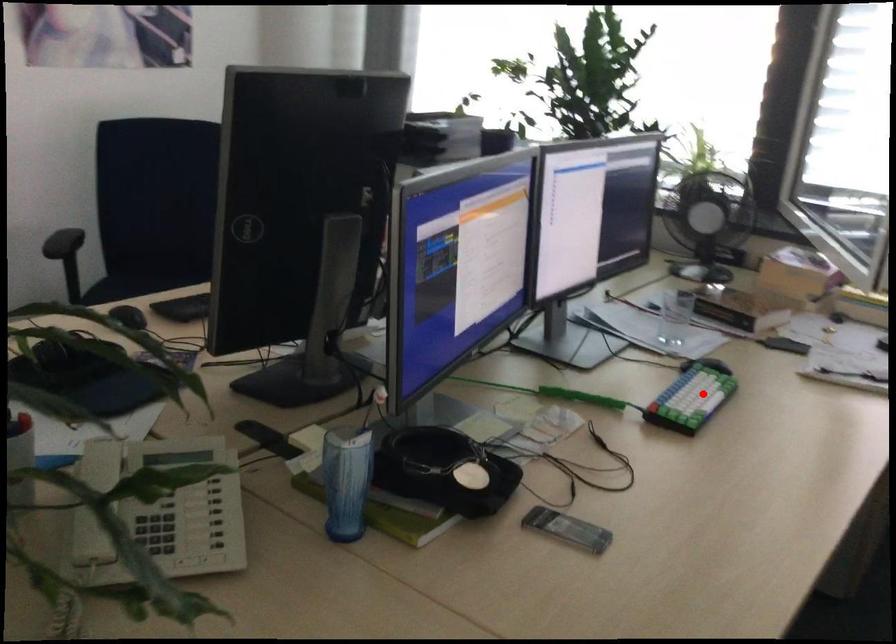
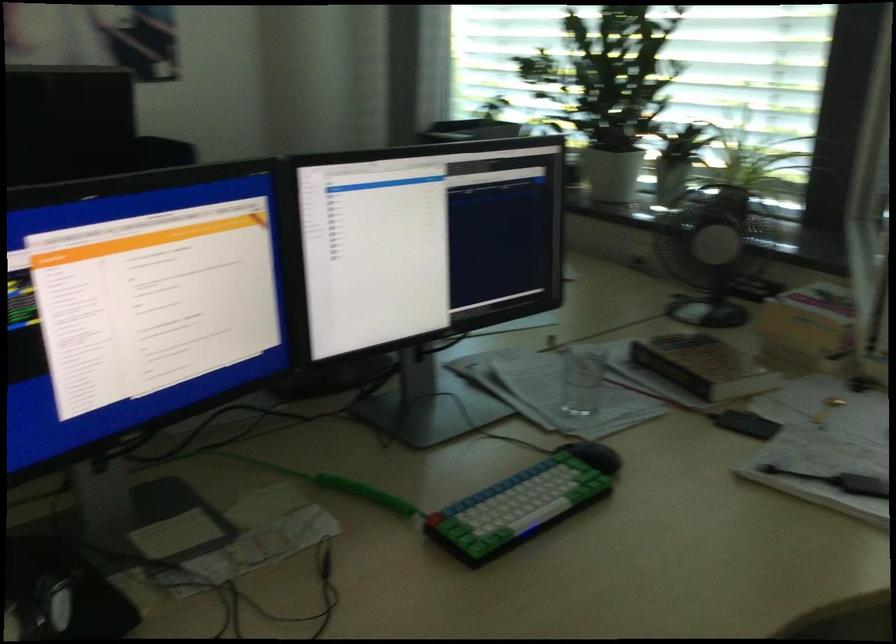
Find the pixel in the second image that matches the highlighted location in the first image.

(523, 503)